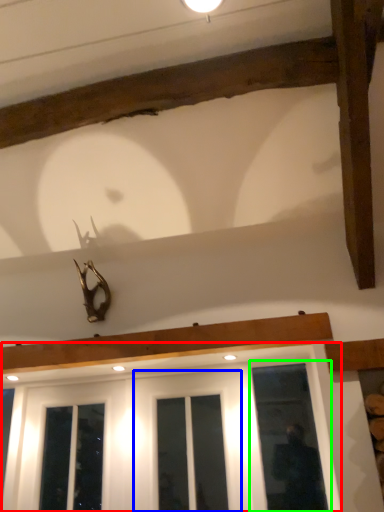
Question: Estimate the real-world distances between objects in this image. Which object is closer to window (highlighted by a red box), screen door (highlighted by a blue box) or window (highlighted by a green box)?

Choices:
 (A) screen door
 (B) window

Answer: (A)